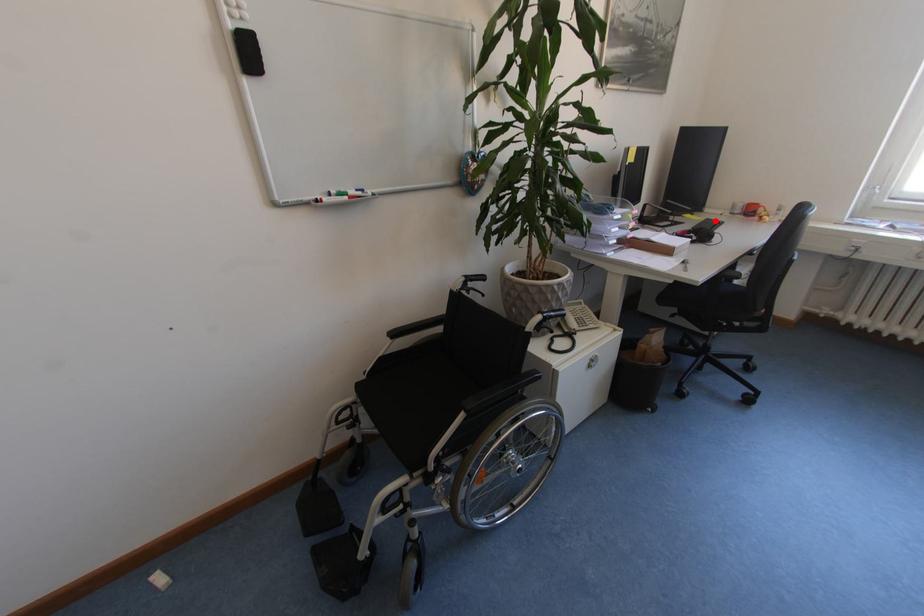
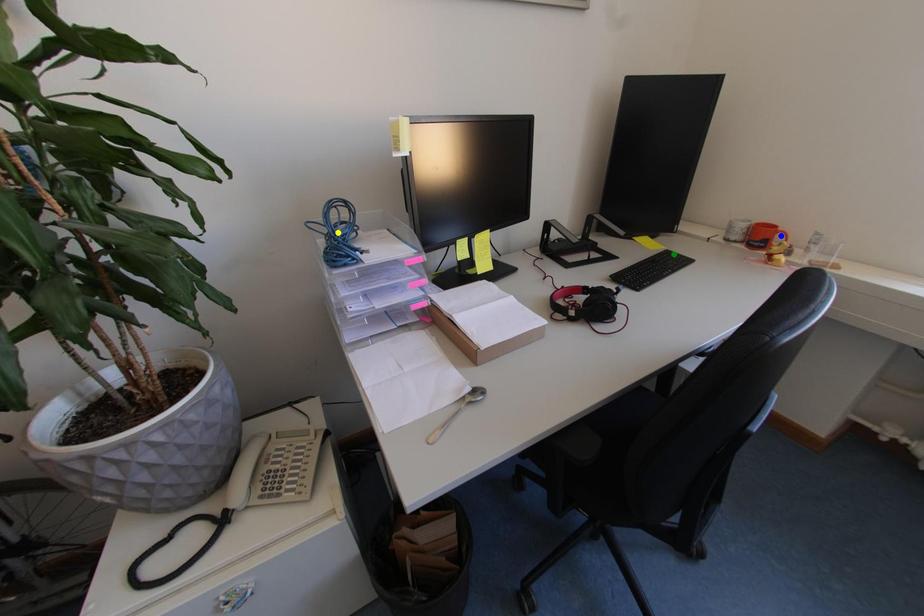
Question: I am providing you with two images of the same scene from different viewpoints. A red point is marked on the first image. You are given multiple points on the second image. Which spot in image 2 lines up with the point in image 1?

Choices:
 (A) green point
 (B) blue point
 (C) yellow point

Answer: (A)